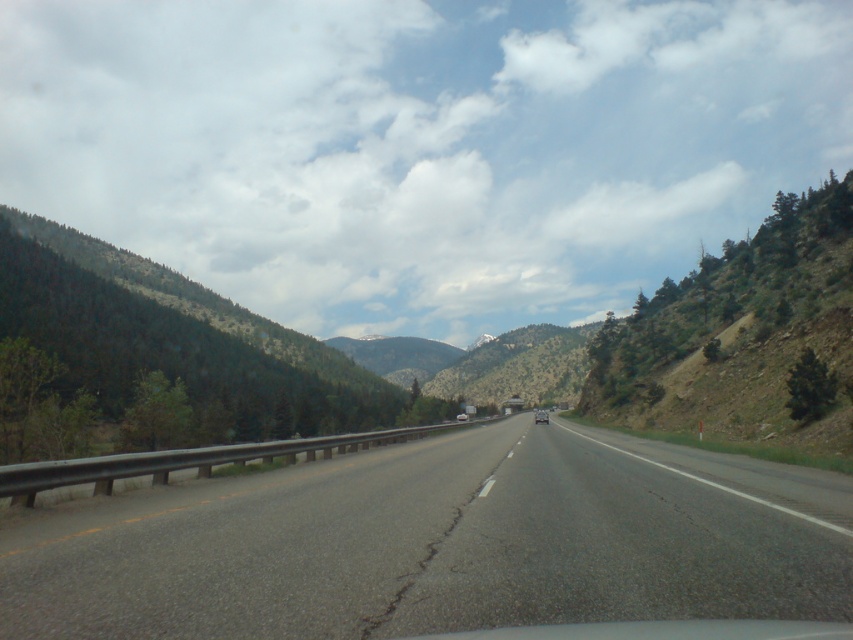
You are a surveyor tasked with placing a marker exactly at the center of the asphalt road at center. Based on the coordinates provided in the Objects Description, what are the coordinates where you should place the marker?

The asphalt road at center is located at point (438, 545), so you should place the marker at those coordinates.

You are a driver approaching the highway and see the asphalt road at center and the metallic silver car at center. Which object takes up more visual space in the image?

The metallic silver car at center takes up more visual space than the asphalt road at center.

You are a delivery truck driver with a vehicle that is 2.5 meters wide. You need to pass through a narrow section of the highway where only one lane is available. You see a metallic silver car at center and a white glossy car at center ahead. Can your truck fit between them if they are both stopped in their respective lanes?

The metallic silver car at center might be wider than the white glossy car at center. Since the truck is 2.5 meters wide, it depends on the actual width of the metallic silver car at center. If it is wider, there might be insufficient space. However, without exact measurements, it is uncertain whether the truck can safely pass between them.